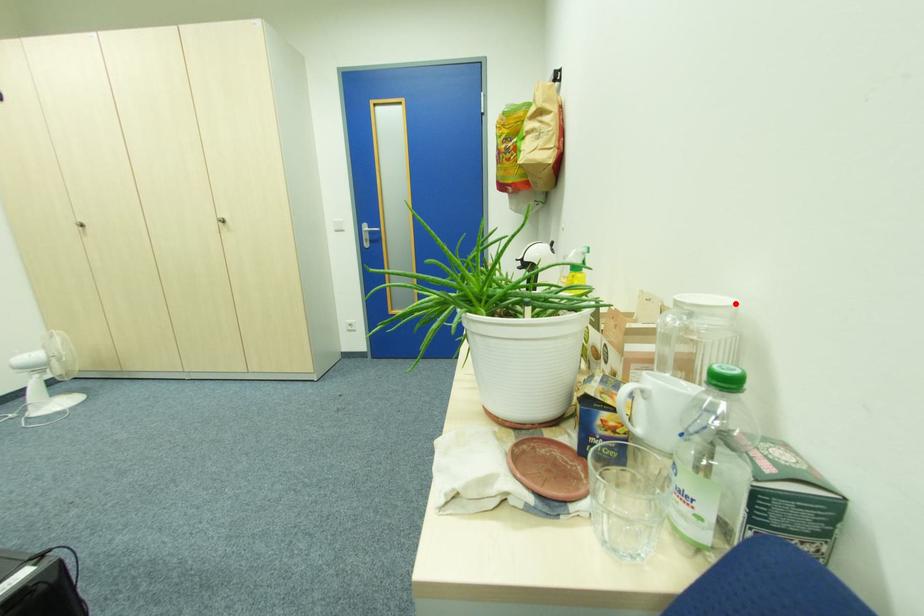
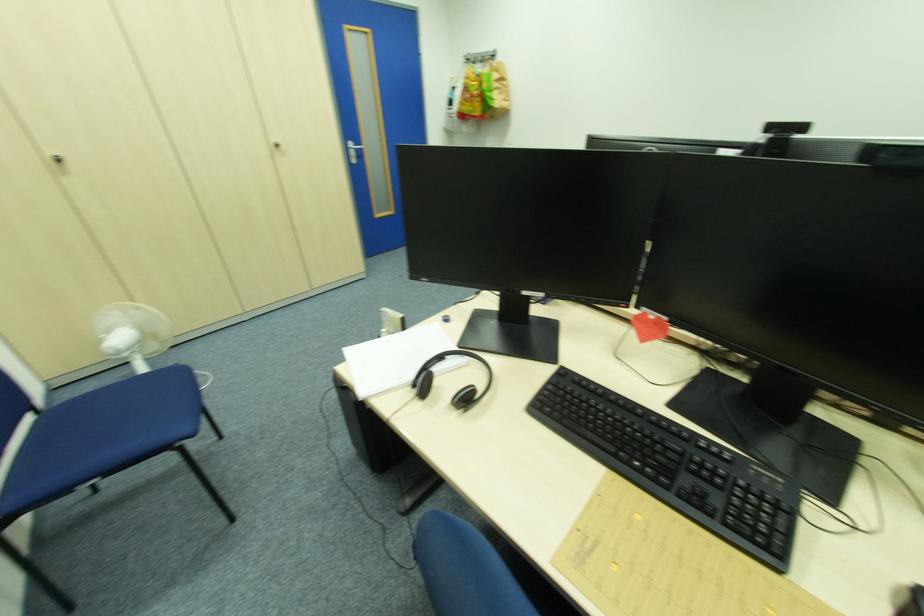
Question: I am providing you with two images of the same scene from different viewpoints. A red point is marked on the first image. At the location where the point appears in image 1, is it still visible in image 2?

Choices:
 (A) Yes
 (B) No

Answer: (B)